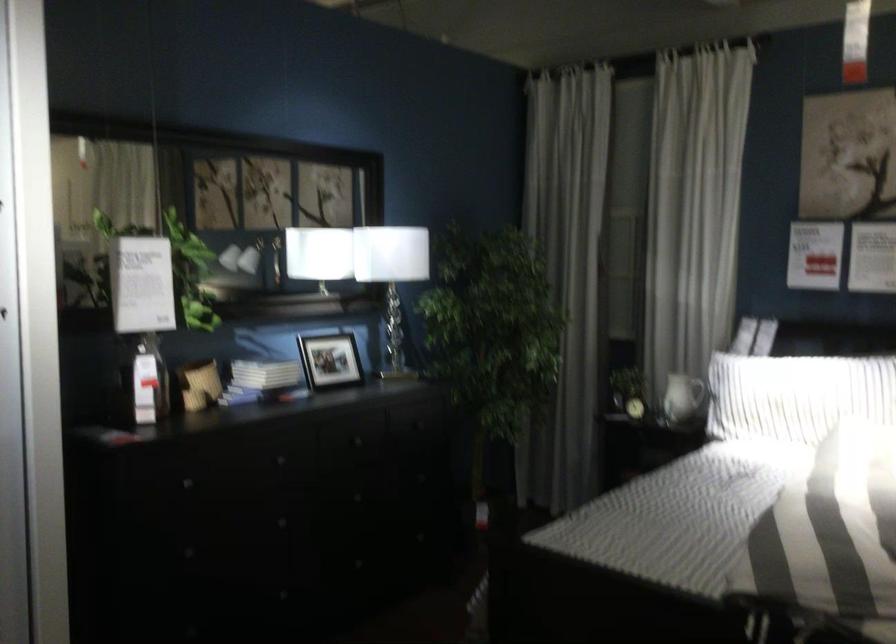
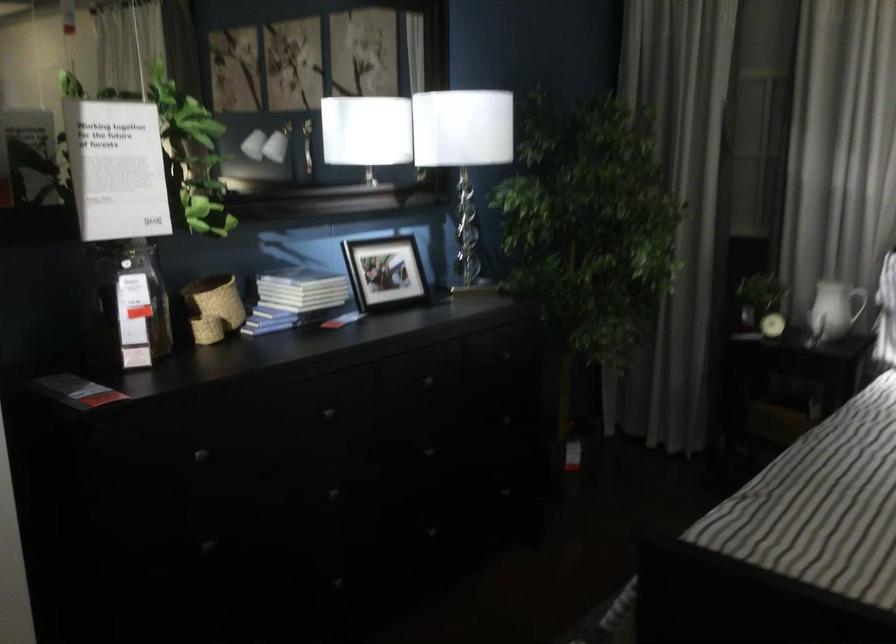
Locate, in the second image, the point that corresponds to the point at 330,361 in the first image.

(384, 272)